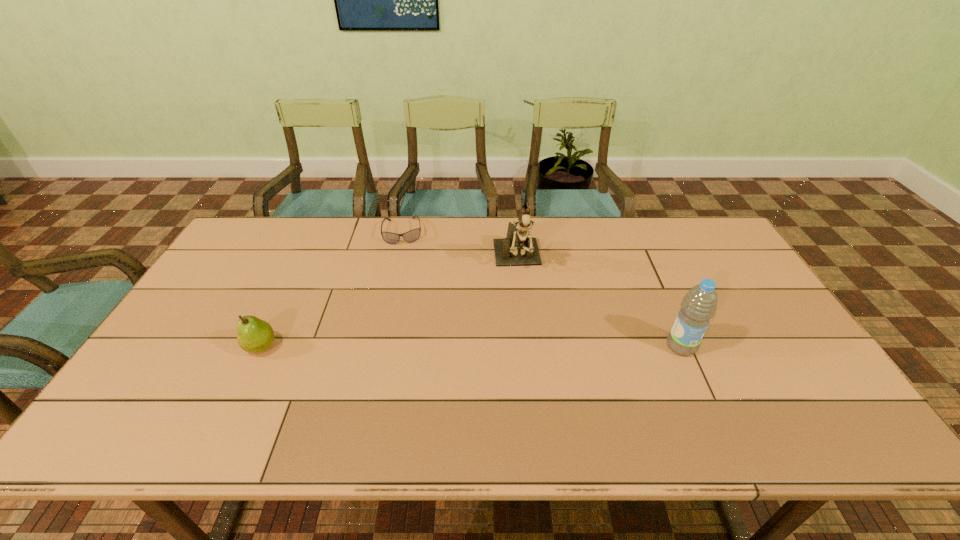
At what (x,y) coordinates should I click in order to perform the action: click on free location located 0.400m on the lenses of the shortest object. Please return your answer as a coordinate pair (x, y). Looking at the image, I should click on (409, 332).

Find the location of a particular element. The height and width of the screenshot is (540, 960). vacant space located on the lenses of the shortest object is located at coordinates (407, 307).

Where is `vacant space located on the lenses of the shortest object`? This screenshot has height=540, width=960. vacant space located on the lenses of the shortest object is located at coordinates (404, 254).

Identify the location of free location located on the front-facing side of the third object from left to right. (535, 363).

Locate an element on the screen. vacant area located 0.180m on the front-facing side of the third object from left to right is located at coordinates (528, 328).

You are a GUI agent. You are given a task and a screenshot of the screen. Output one action in this format:
    pyautogui.click(x=<x>, y=<y>)
    Task: Click on the vacant space located 0.290m on the front-facing side of the third object from left to right
    The image size is (960, 540).
    Given the screenshot: What is the action you would take?
    pyautogui.click(x=534, y=360)

At what (x,y) coordinates should I click in order to perform the action: click on sunglasses that is at the far edge. Please return your answer as a coordinate pair (x, y). Looking at the image, I should click on (411, 236).

Find the location of `figurine located at the far edge`. figurine located at the far edge is located at coordinates (517, 249).

In the image, there is a desktop. Identify the location of vacant space at the far edge. (593, 218).

I want to click on vacant space at the near edge, so pyautogui.click(x=258, y=389).